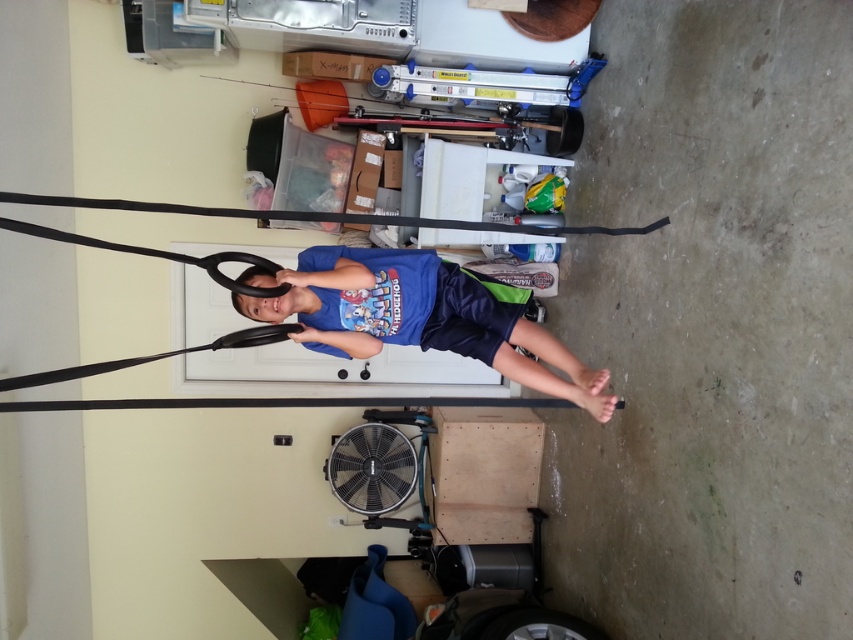
You are standing in a garage and see a point marked at coordinates (x=474, y=353). If you want to place a 3 meter long ladder against the wall behind this point, will the ladder reach the wall without exceeding the garage height?

The point at (x=474, y=353) is 2.84 meters away from you. Since the ladder is 3 meters long, it can reach the wall behind the point as the distance is less than the ladder length.

You are a physical therapist observing a child exercising in a garage. The child is wearing the blue cotton shirt at center and using equipment near the black rubber tire at lower center. Based on their positions, which object is higher from the ground?

The blue cotton shirt at center is above the black rubber tire at lower center, so the blue cotton shirt at center is higher from the ground.

You are a photographer trying to capture the exact center of the image. You see the blue cotton shirt at center in the scene. Where would you aim your camera to ensure the shirt is centered?

The blue cotton shirt at center is positioned at the coordinates point (418, 317), so aiming your camera at those coordinates would center the shirt in the image.